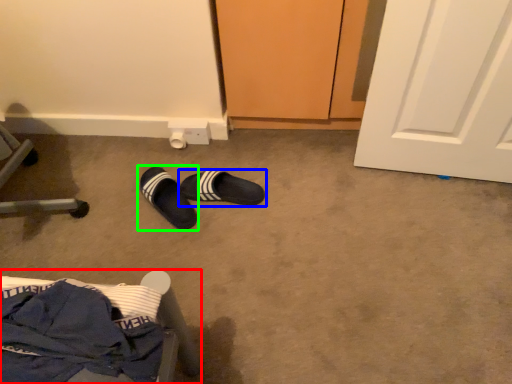
Question: Based on their relative distances, which object is farther from furniture (highlighted by a red box)? Choose from footwear (highlighted by a blue box) and footwear (highlighted by a green box).

Choices:
 (A) footwear
 (B) footwear

Answer: (A)